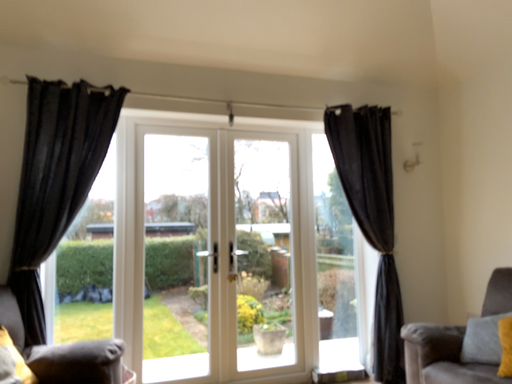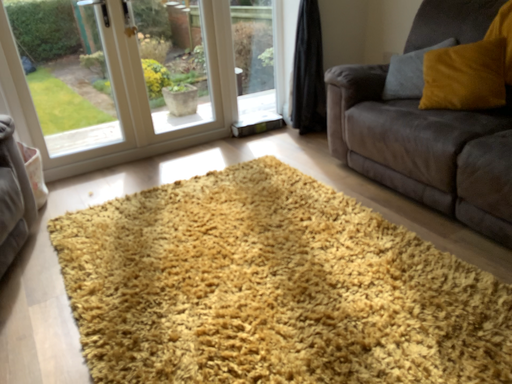
Question: Which way did the camera rotate in the video?

Choices:
 (A) rotated left
 (B) rotated right

Answer: (B)